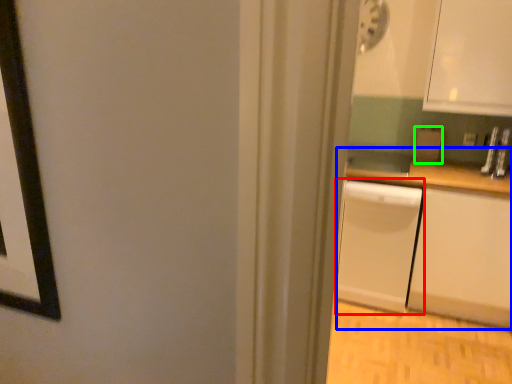
Question: Which object is the closest to the dish washer (highlighted by a red box)? Choose among these: counter (highlighted by a blue box) or appliance (highlighted by a green box).

Choices:
 (A) counter
 (B) appliance

Answer: (A)